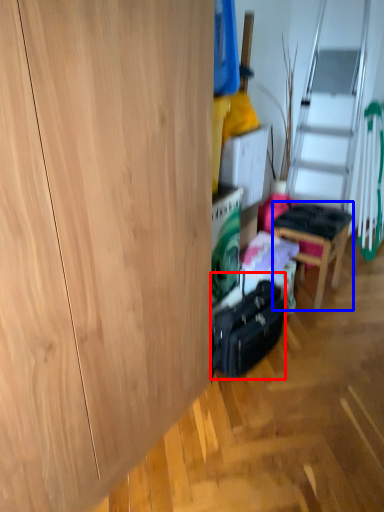
Question: Among these objects, which one is nearest to the camera, luggage (highlighted by a red box) or chair (highlighted by a blue box)?

Choices:
 (A) luggage
 (B) chair

Answer: (A)